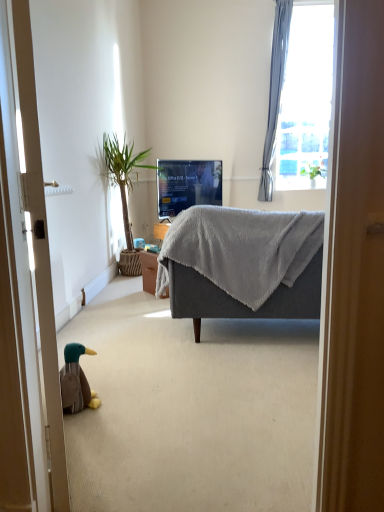
Where is `vacant space that's between gray soft fabric couch at center and brown plush duck at lower left`? The width and height of the screenshot is (384, 512). vacant space that's between gray soft fabric couch at center and brown plush duck at lower left is located at coordinates (187, 364).